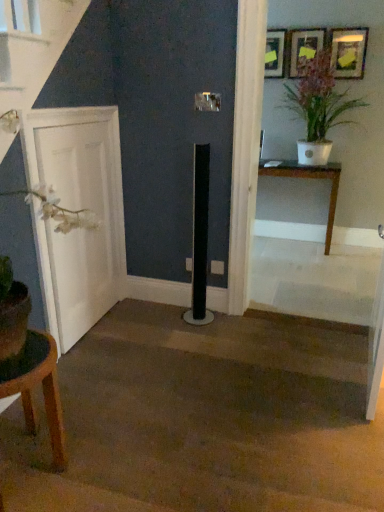
Find the location of a particular element. The image size is (384, 512). free space behind brown wooden table at lower left, the 1th table positioned from the bottom is located at coordinates pyautogui.click(x=72, y=404).